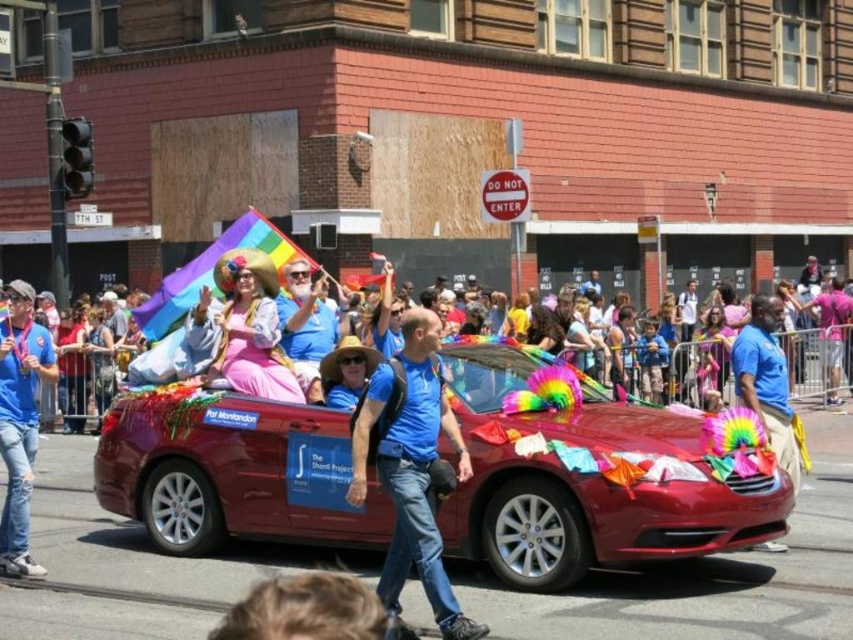
You are a photographer positioned at the edge of the Pride parade route. You want to capture a photo of the shiny red convertible at center and the blue denim jeans at left in the same frame. Given that your camera has a maximum focus range of 4 meters, will both subjects be in focus?

The shiny red convertible at center is 4.10 meters away from blue denim jeans at left. Since the distance between them is slightly over the camera maximum focus range of 4 meters, the subjects might not be in focus together.

In the Pride parade scene, there are two people wearing blue denim jeans at left and a pastel fabric dress at center. Which clothing item is lower in position compared to the other?

The blue denim jeans at left is positioned under the pastel fabric dress at center, so it is lower in position.

You are a participant in the Pride parade and want to take a photo of the convertible car. You notice two points marked on the car, one at point (225, 324) and the other at point (281, 332). Which point is closer to the front of the car?

Point (225, 324) is in front of point (281, 332), so the point at (225, 324) is closer to the front of the car.